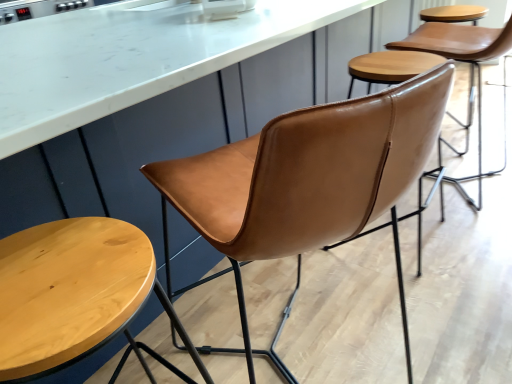
Question: Considering their positions, is wooden stool at lower left located in front of or behind cognac leather chair at center, arranged as the first chair when viewed from the left?

Choices:
 (A) front
 (B) behind

Answer: (B)

Question: Is wooden stool at lower left situated inside cognac leather chair at center, acting as the 1th chair starting from the front, or outside?

Choices:
 (A) inside
 (B) outside

Answer: (B)

Question: Which of these objects is positioned closest to the cognac leather chair at center, arranged as the first chair when viewed from the left?

Choices:
 (A) cognac leather chair at center, the 2th chair positioned from the front
 (B) wooden stool at lower left

Answer: (B)

Question: Which of these objects is positioned farthest from the cognac leather chair at center, the 2th chair positioned from the front?

Choices:
 (A) wooden stool at lower left
 (B) cognac leather chair at center, which is the second chair in back-to-front order

Answer: (A)